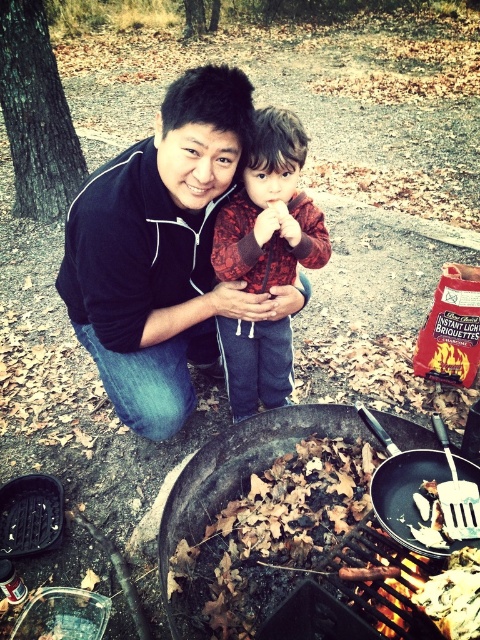
Question: Considering the relative positions of charcoal grill at center and black matte frying pan at lower center in the image provided, where is charcoal grill at center located with respect to black matte frying pan at lower center?

Choices:
 (A) below
 (B) above

Answer: (A)

Question: Which object is the closest to the charcoal grill at center?

Choices:
 (A) red plaid shirt at center
 (B) black matte jacket at center

Answer: (B)

Question: Which point appears farthest from the camera in this image?

Choices:
 (A) (100, 230)
 (B) (305, 426)

Answer: (B)

Question: Considering the relative positions of charcoal grill at center and red plaid shirt at center in the image provided, where is charcoal grill at center located with respect to red plaid shirt at center?

Choices:
 (A) below
 (B) above

Answer: (A)

Question: Does black matte jacket at center appear on the left side of red plaid shirt at center?

Choices:
 (A) no
 (B) yes

Answer: (B)

Question: Which object is farther from the camera taking this photo?

Choices:
 (A) black matte jacket at center
 (B) black matte frying pan at lower center
 (C) red plaid shirt at center

Answer: (C)